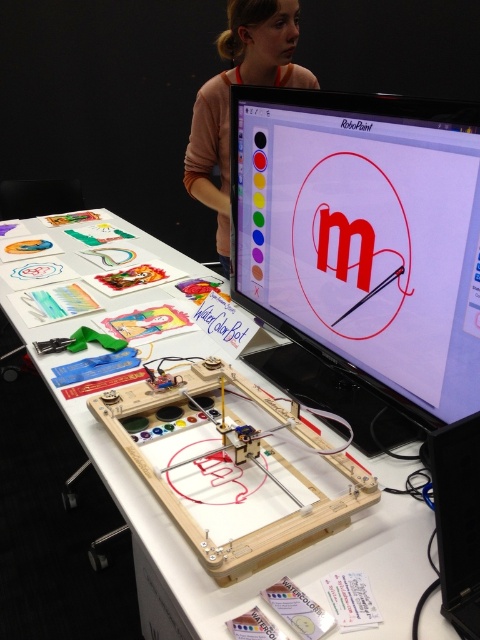
Question: Is wooden board game at center thinner than pink fabric at upper center?

Choices:
 (A) no
 (B) yes

Answer: (A)

Question: Among these points, which one is farthest from the camera?

Choices:
 (A) (320, 577)
 (B) (266, 307)
 (C) (168, 461)
 (D) (288, 45)

Answer: (D)

Question: Can you confirm if matte plastic monitor at upper center is smaller than wooden board game at center?

Choices:
 (A) no
 (B) yes

Answer: (A)

Question: Which point is farther to the camera?

Choices:
 (A) (226, 189)
 (B) (242, 588)
 (C) (244, 480)

Answer: (A)

Question: Can you confirm if matte plastic monitor at upper center is positioned above white wood table at center?

Choices:
 (A) yes
 (B) no

Answer: (A)

Question: Which point appears farthest from the camera in this image?

Choices:
 (A) (215, 426)
 (B) (239, 13)
 (C) (416, 355)
 (D) (394, 568)

Answer: (B)